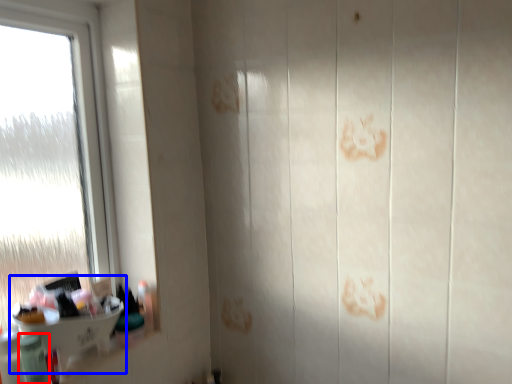
Question: Which object appears closest to the camera in this image, toiletry (highlighted by a red box) or sink (highlighted by a blue box)?

Choices:
 (A) toiletry
 (B) sink

Answer: (A)